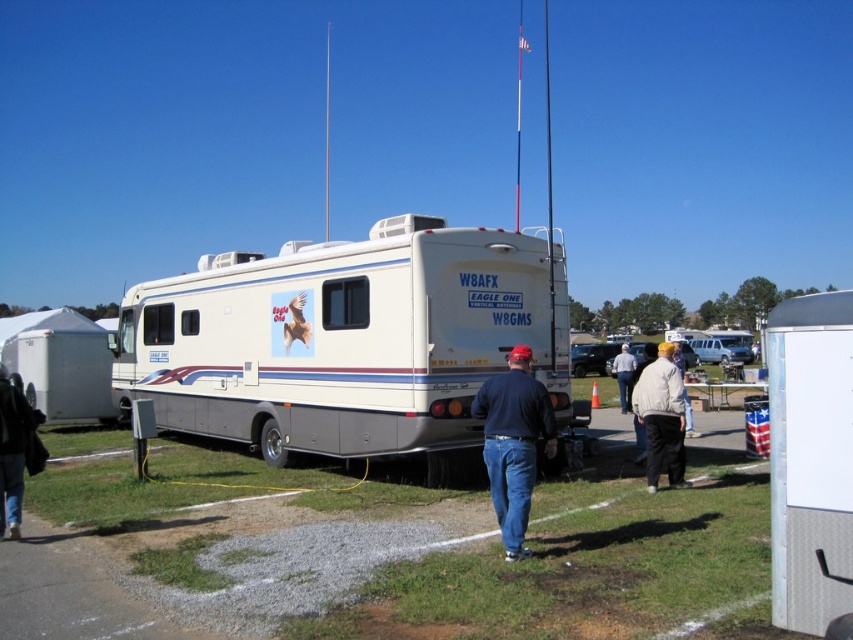
Question: Can you confirm if white glossy rv at center is wider than blue denim jeans at center?

Choices:
 (A) no
 (B) yes

Answer: (B)

Question: Which object appears closest to the camera in this image?

Choices:
 (A) white cotton shirt at center
 (B) light beige jacket at center
 (C) white glossy rv at center
 (D) blue denim jeans at center

Answer: (D)

Question: Considering the real-world distances, which object is farthest from the black leather jacket at lower left?

Choices:
 (A) white glossy rv at center
 (B) blue denim jeans at center
 (C) light beige jacket at center

Answer: (C)

Question: Which is farther from the light beige jacket at center?

Choices:
 (A) white glossy rv at center
 (B) blue denim jeans at center
 (C) black leather jacket at lower left
 (D) white cotton shirt at center

Answer: (D)

Question: Does blue denim jeans at center have a lesser width compared to black leather jacket at lower left?

Choices:
 (A) yes
 (B) no

Answer: (B)

Question: Observing the image, what is the correct spatial positioning of white glossy rv at center in reference to blue denim jeans at center?

Choices:
 (A) below
 (B) above

Answer: (B)